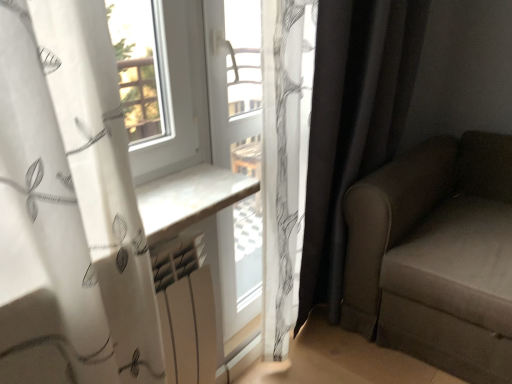
Question: Is black fabric curtain at right in front of or behind suede-like brown couch at right in the image?

Choices:
 (A) front
 (B) behind

Answer: (B)

Question: From their relative heights in the image, would you say black fabric curtain at right is taller or shorter than suede-like brown couch at right?

Choices:
 (A) short
 (B) tall

Answer: (B)

Question: Which object is the closest to the black fabric curtain at right?

Choices:
 (A) white matte radiator at center
 (B) suede-like brown couch at right
 (C) white plastic window frame at center

Answer: (B)

Question: Which object is positioned closest to the black fabric curtain at right?

Choices:
 (A) white matte radiator at center
 (B) suede-like brown couch at right
 (C) white plastic window frame at center

Answer: (B)